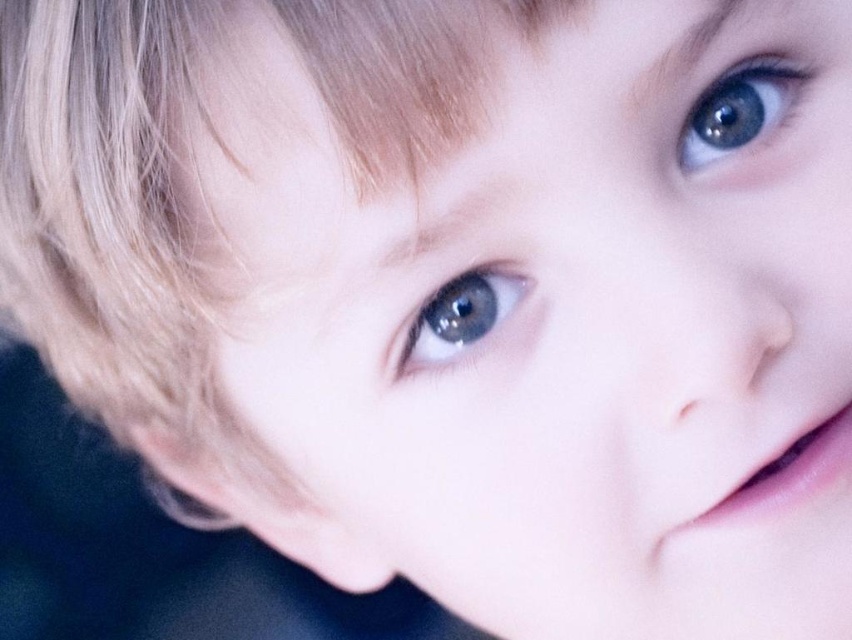
From the picture: You are a photographer trying to capture a closeup of a child. The child has two blue glossy eyes, one at upper center and one at center. You want to ensure that the distance between the two eyes in the photo matches the natural human eye spacing. Given that the average distance between human eyes is about 3.71 inches, does the distance between the blue glossy eye at upper center and the blue glossy eye at center in the image match the average human eye spacing?

The blue glossy eye at upper center is 3.71 inches away from the blue glossy eye at center, so the distance between them matches the average human eye spacing of 3.71 inches.